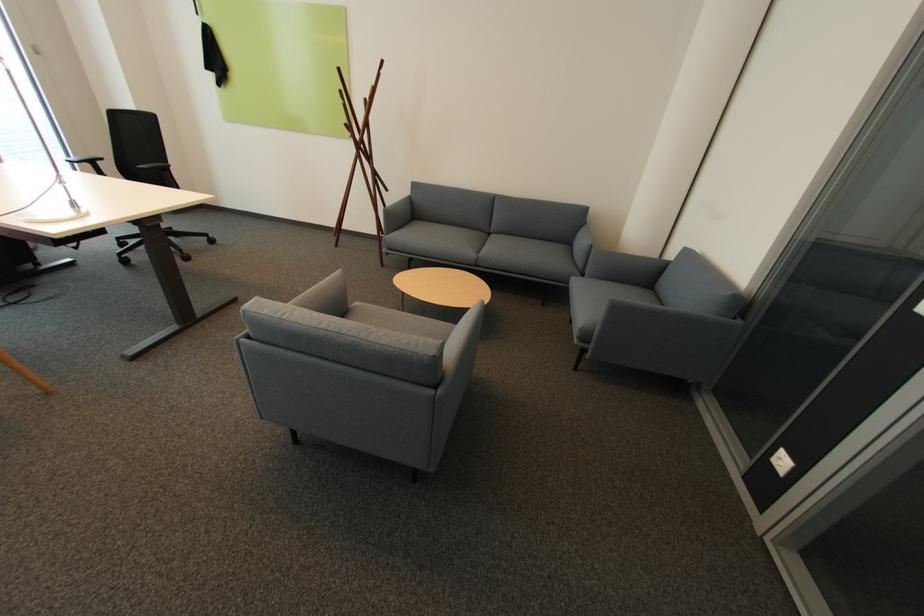
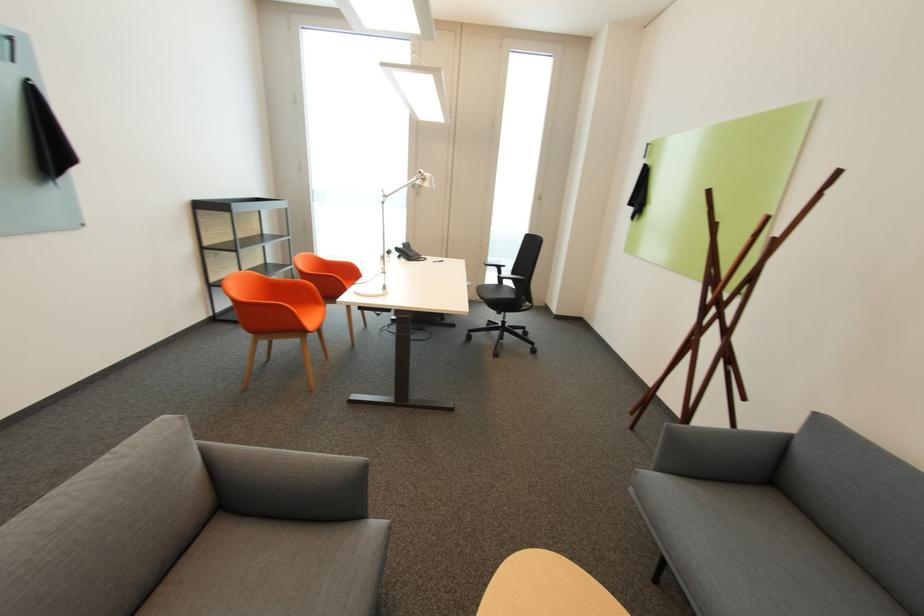
In the second image, find the point that corresponds to pixel 94 166 in the first image.

(503, 269)